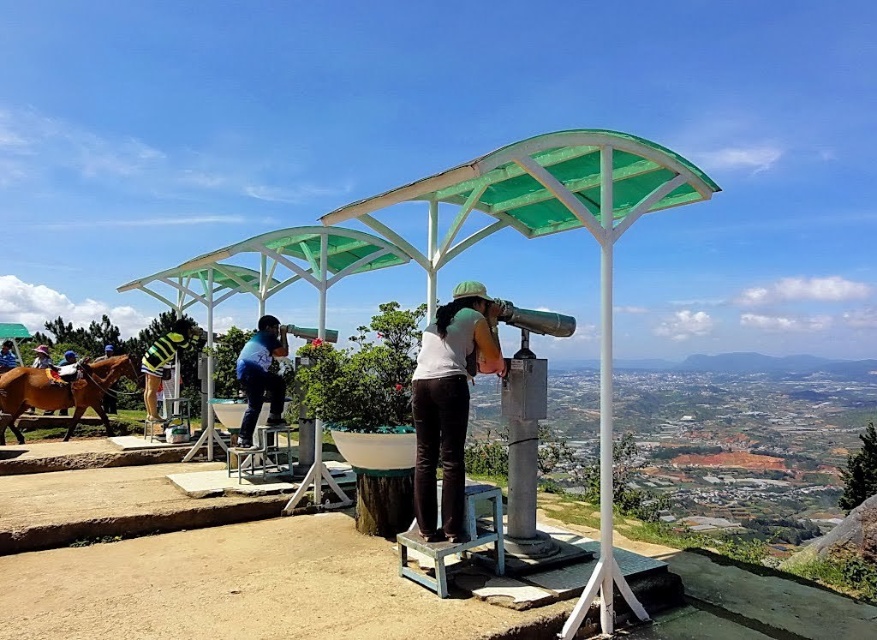
Question: Which object appears closest to the camera in this image?

Choices:
 (A) blue fabric shirt at center
 (B) blue striped shirt at left
 (C) green striped shirt at left
 (D) white matte shirt at center

Answer: (D)

Question: Is blue fabric shirt at center thinner than green striped shirt at left?

Choices:
 (A) yes
 (B) no

Answer: (B)

Question: Estimate the real-world distances between objects in this image. Which object is farther from the blue fabric shirt at center?

Choices:
 (A) green striped shirt at left
 (B) brown glossy horse at left
 (C) blue striped shirt at left
 (D) striped jersey at center

Answer: (C)

Question: Can you confirm if white matte shirt at center is positioned to the right of striped jersey at center?

Choices:
 (A) no
 (B) yes

Answer: (B)

Question: Which of these objects is positioned farthest from the green striped shirt at left?

Choices:
 (A) white matte shirt at center
 (B) blue striped shirt at left

Answer: (A)

Question: Considering the relative positions of brown glossy horse at left and blue fabric shirt at center in the image provided, where is brown glossy horse at left located with respect to blue fabric shirt at center?

Choices:
 (A) below
 (B) above

Answer: (A)